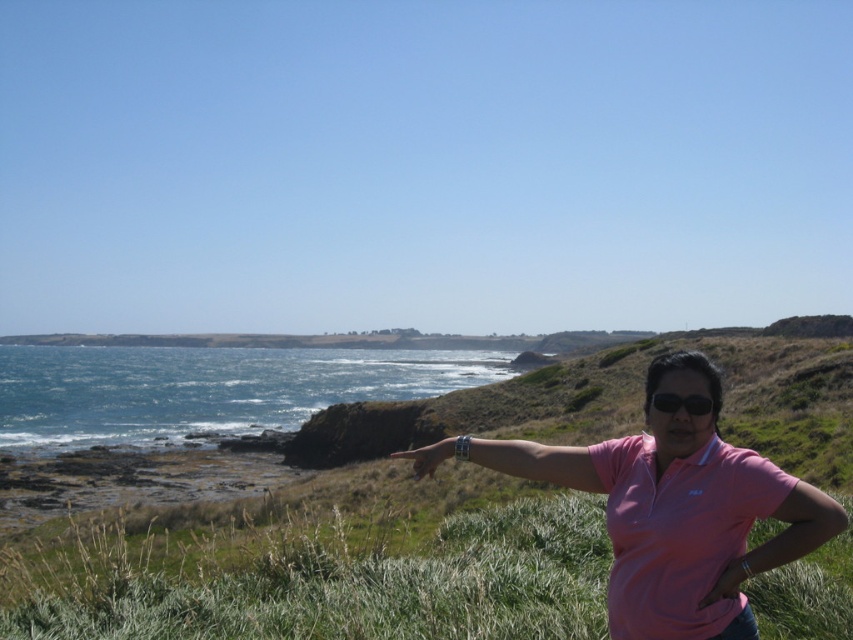
Does green grassy at lower center come in front of pink cotton shirt at center?

No, it is not.

Is green grassy at lower center taller than pink cotton shirt at center?

In fact, green grassy at lower center may be shorter than pink cotton shirt at center.

What do you see at coordinates (363, 588) in the screenshot? The height and width of the screenshot is (640, 853). I see `green grassy at lower center` at bounding box center [363, 588].

Where is `green grassy at lower center`? green grassy at lower center is located at coordinates (363, 588).

Locate an element on the screen. Image resolution: width=853 pixels, height=640 pixels. green grassy at lower center is located at coordinates click(x=363, y=588).

Which is in front, point (401, 637) or point (671, 403)?

Positioned in front is point (671, 403).

Image resolution: width=853 pixels, height=640 pixels. I want to click on green grassy at lower center, so click(363, 588).

Who is lower down, pink cotton shirt at center or black matte sunglasses at center?

pink cotton shirt at center

Which of these two, pink cotton shirt at center or black matte sunglasses at center, stands shorter?

With less height is black matte sunglasses at center.

Does point (650, 538) lie in front of point (695, 412)?

No, it is behind (695, 412).

Identify the location of pink cotton shirt at center. The width and height of the screenshot is (853, 640). (671, 508).